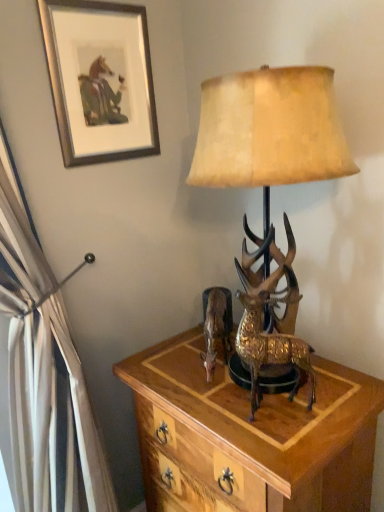
At what (x,y) coordinates should I click in order to perform the action: click on free space below gold textured deer at center (from a real-world perspective). Please return your answer as a coordinate pair (x, y). The width and height of the screenshot is (384, 512). Looking at the image, I should click on (274, 382).